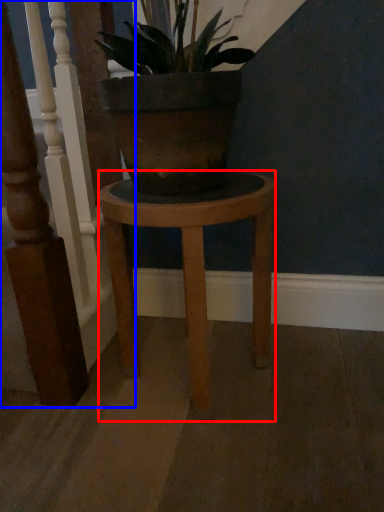
Question: Which object is closer to the camera taking this photo, stool (highlighted by a red box) or rail (highlighted by a blue box)?

Choices:
 (A) stool
 (B) rail

Answer: (B)